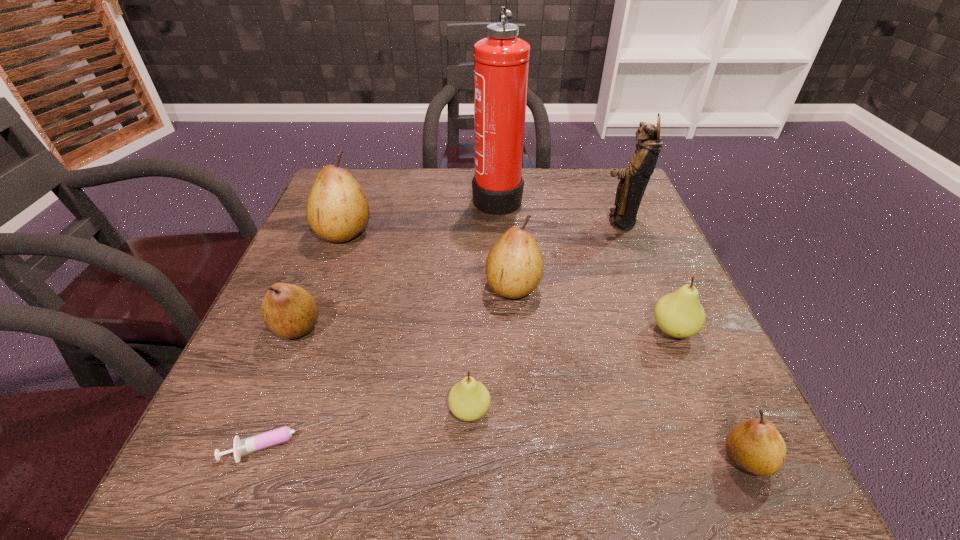
Locate an element on the screen. This screenshot has height=540, width=960. vacant space that satisfies the following two spatial constraints: 1. on the front side of the rightmost brown pear; 2. on the left side of the syringe is located at coordinates (273, 458).

In order to click on vacant space that satisfies the following two spatial constraints: 1. on the front-facing side of the figurine; 2. on the back side of the nearest pear in this screenshot , I will do `click(716, 458)`.

Find the location of `free space in the image that satisfies the following two spatial constraints: 1. on the front-facing side of the tallest object; 2. on the right side of the right green pear`. free space in the image that satisfies the following two spatial constraints: 1. on the front-facing side of the tallest object; 2. on the right side of the right green pear is located at coordinates (504, 330).

Where is `vacant space that satisfies the following two spatial constraints: 1. on the front-facing side of the tallest object; 2. on the left side of the fifth nearest pear`? vacant space that satisfies the following two spatial constraints: 1. on the front-facing side of the tallest object; 2. on the left side of the fifth nearest pear is located at coordinates (502, 287).

Locate an element on the screen. vacant region that satisfies the following two spatial constraints: 1. on the front-facing side of the smallest brown pear; 2. on the left side of the second tallest object is located at coordinates tap(716, 458).